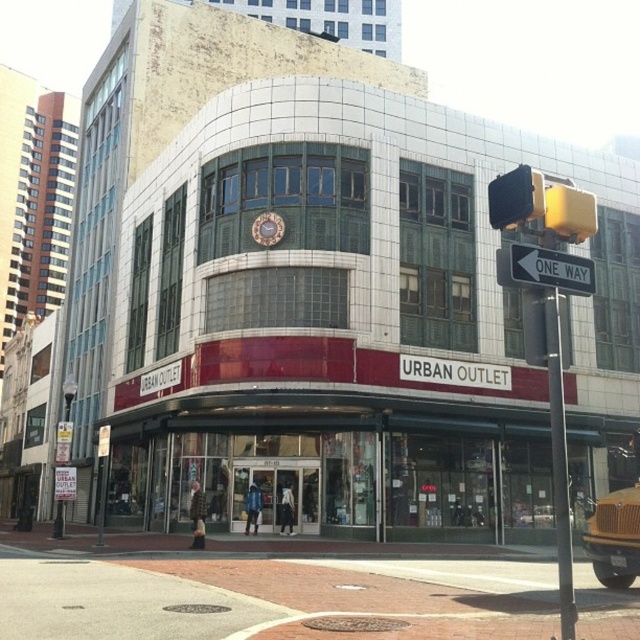
You are standing in front of the building and see two points marked on its curved facade. According to their positions, which point is closer to you, point (588, 276) or point (499, 196)?

Point (588, 276) is in front of point (499, 196), so it is closer to you.

You are a delivery person standing 10 meters away from the building. You need to place a package at the matte glass storefront at center. However, there is a white plastic street sign at upper center above it. Can you safely place the package without hitting the sign?

The distance between the matte glass storefront at center and the white plastic street sign at upper center is 33.74 meters. Since you are only 10 meters away from the building, the vertical distance between the two objects is sufficient for placing the package safely without hitting the sign.